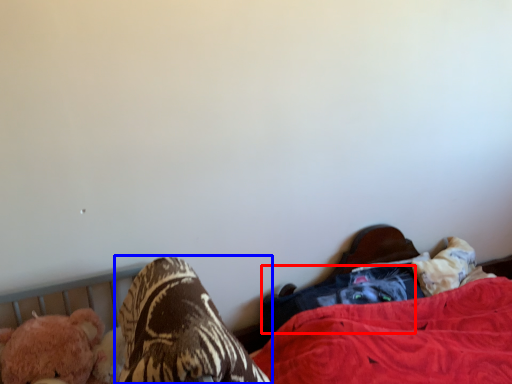
Question: Among these objects, which one is farthest to the camera, clothing (highlighted by a red box) or footwear (highlighted by a blue box)?

Choices:
 (A) clothing
 (B) footwear

Answer: (A)